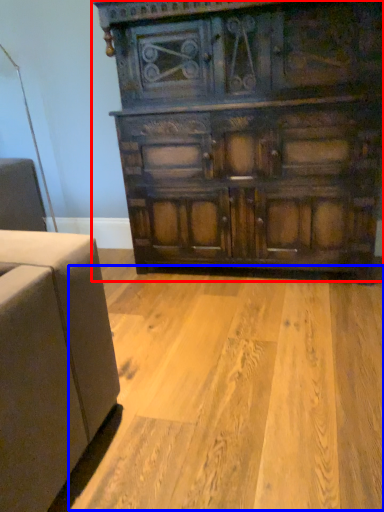
Question: Among these objects, which one is nearest to the camera, chest of drawers (highlighted by a red box) or plywood (highlighted by a blue box)?

Choices:
 (A) chest of drawers
 (B) plywood

Answer: (B)